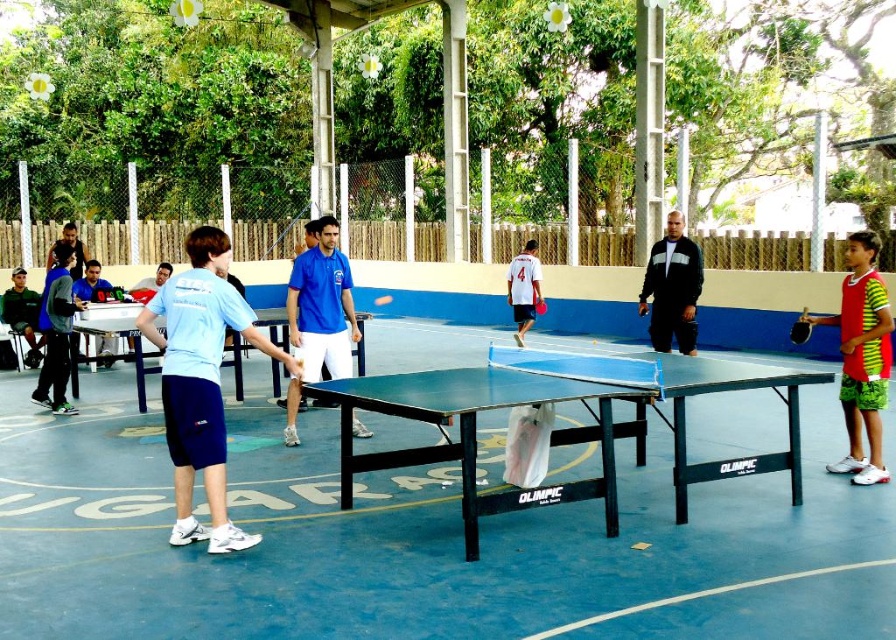
Is the position of white matte shirt at center more distant than that of white matte ping pong paddle at left?

Yes, white matte shirt at center is further from the viewer.

Where is `white matte shirt at center`? white matte shirt at center is located at coordinates pyautogui.click(x=524, y=289).

Can you confirm if blue glossy table at center is thinner than blue glossy ping pong table at center?

No.

Between blue glossy table at center and blue glossy ping pong table at center, which one has less height?

With less height is blue glossy table at center.

This screenshot has width=896, height=640. What do you see at coordinates (475, 433) in the screenshot? I see `blue glossy table at center` at bounding box center [475, 433].

Where is `blue glossy table at center`? This screenshot has height=640, width=896. blue glossy table at center is located at coordinates (475, 433).

Who is positioned more to the right, white matte ping pong paddle at left or orange matte ping pong paddle at center?

orange matte ping pong paddle at center is more to the right.

Who is higher up, white matte ping pong paddle at left or orange matte ping pong paddle at center?

Positioned higher is white matte ping pong paddle at left.

At what (x,y) coordinates should I click in order to perform the action: click on white matte ping pong paddle at left. Please return your answer as a coordinate pair (x, y). Image resolution: width=896 pixels, height=640 pixels. Looking at the image, I should click on (90, 284).